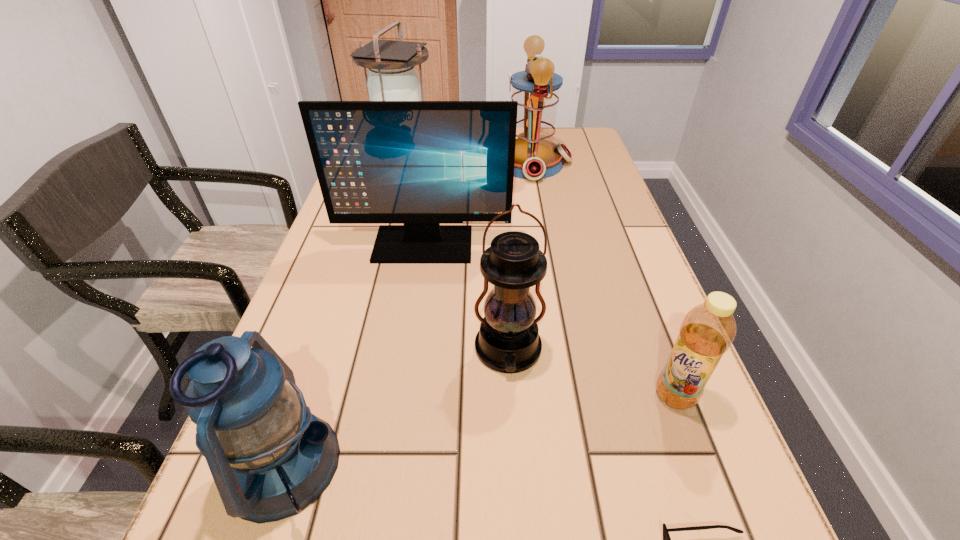
Locate an element on the screen. This screenshot has width=960, height=540. the fifth nearest object is located at coordinates (419, 163).

You are a GUI agent. You are given a task and a screenshot of the screen. Output one action in this format:
    pyautogui.click(x=<x>, y=<y>)
    Task: Click on the second nearest lantern
    This screenshot has height=540, width=960.
    Given the screenshot: What is the action you would take?
    pyautogui.click(x=508, y=341)

The height and width of the screenshot is (540, 960). I want to click on bottle, so click(707, 331).

Identify the location of free space located on the screen side of the third farthest object. (401, 390).

Find a few locations in the blank space located above the second nearest lantern, indicating its light source. Please provide its 2D coordinates. Your answer should be formatted as a tuple, i.e. [(x, y)], where the tuple contains the x and y coordinates of a point satisfying the conditions above.

[(513, 427)]

Where is `free space located on the front of the second shortest object`? This screenshot has height=540, width=960. free space located on the front of the second shortest object is located at coordinates (718, 510).

Locate an element on the screen. This screenshot has width=960, height=540. lantern positioned at the left edge is located at coordinates (392, 77).

The height and width of the screenshot is (540, 960). I want to click on monitor present at the left edge, so click(419, 163).

The height and width of the screenshot is (540, 960). I want to click on lantern at the right edge, so click(536, 89).

Identify the location of bottle located at the right edge. (707, 331).